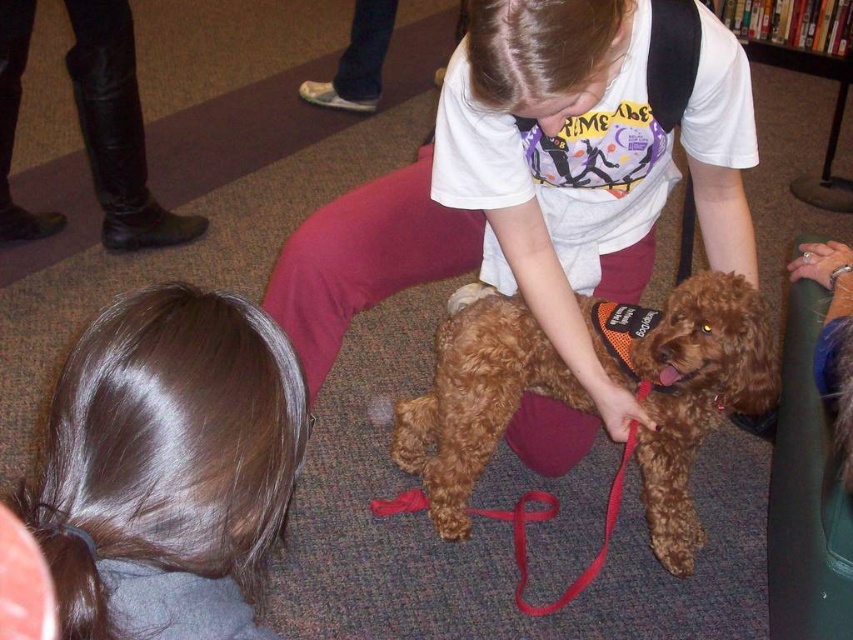
Is brown shiny hair at lower left closer to camera compared to brown fuzzy dog at center?

Yes, it is.

This screenshot has width=853, height=640. What do you see at coordinates (166, 467) in the screenshot? I see `brown shiny hair at lower left` at bounding box center [166, 467].

What do you see at coordinates (166, 467) in the screenshot? This screenshot has height=640, width=853. I see `brown shiny hair at lower left` at bounding box center [166, 467].

Where is `brown shiny hair at lower left`? This screenshot has height=640, width=853. brown shiny hair at lower left is located at coordinates (166, 467).